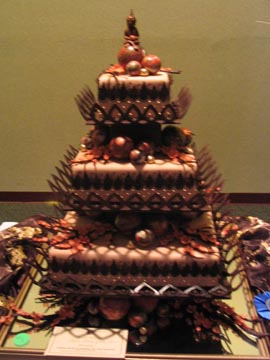
I want to click on dark white wall, so click(41, 116).